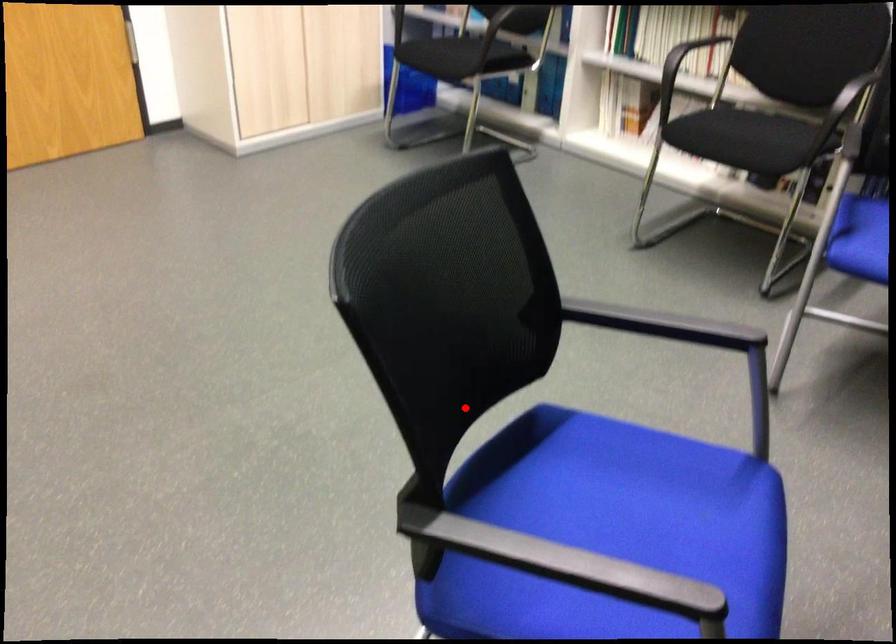
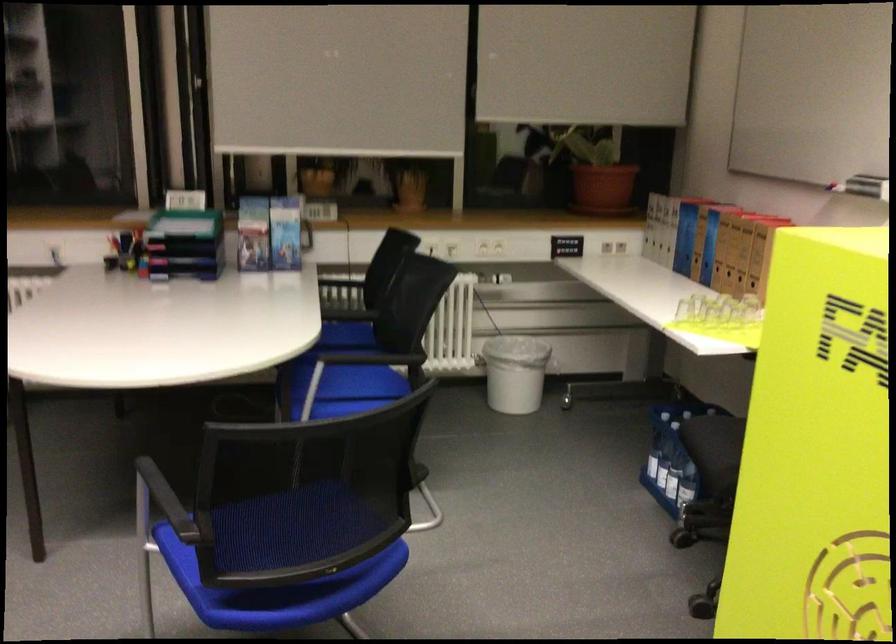
In the second image, find the point that corresponds to the highlighted location in the first image.

(261, 585)